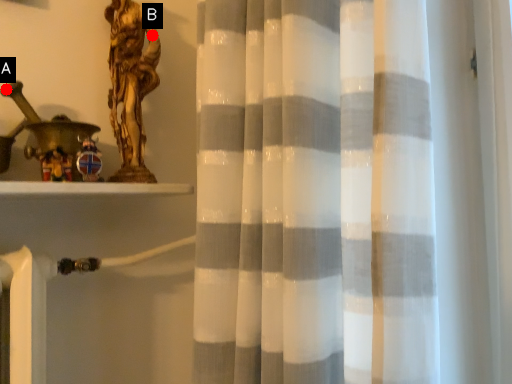
Question: Two points are circled on the image, labeled by A and B beside each circle. Which point appears closest to the camera in this image?

Choices:
 (A) A is closer
 (B) B is closer

Answer: (A)